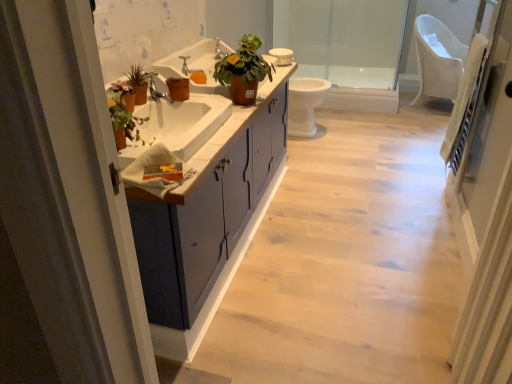
I want to click on free space in front of matte gray cabinet at center, so click(x=291, y=303).